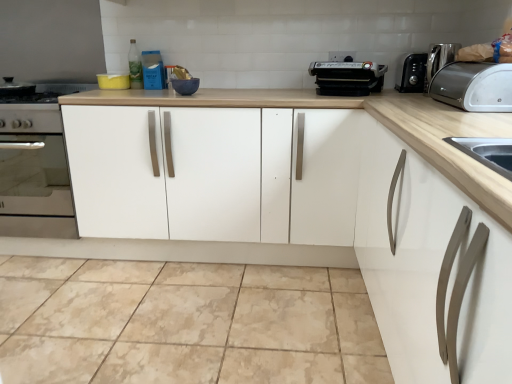
Question: Is satin silver coffee machine at upper right bigger than satin silver toaster at upper right?

Choices:
 (A) yes
 (B) no

Answer: (B)

Question: From the image's perspective, is satin silver coffee machine at upper right beneath satin silver toaster at upper right?

Choices:
 (A) no
 (B) yes

Answer: (A)

Question: Is satin silver coffee machine at upper right not inside satin silver toaster at upper right?

Choices:
 (A) yes
 (B) no

Answer: (A)

Question: From a real-world perspective, is satin silver coffee machine at upper right located higher than satin silver toaster at upper right?

Choices:
 (A) yes
 (B) no

Answer: (A)

Question: Would you say satin silver coffee machine at upper right contains satin silver toaster at upper right?

Choices:
 (A) yes
 (B) no

Answer: (B)

Question: Is satin silver coffee machine at upper right at the right side of satin silver toaster at upper right?

Choices:
 (A) yes
 (B) no

Answer: (B)

Question: Is white matte cabinet at center not near green glass bottle at upper center?

Choices:
 (A) no
 (B) yes

Answer: (A)

Question: From a real-world perspective, does white matte cabinet at center sit lower than green glass bottle at upper center?

Choices:
 (A) yes
 (B) no

Answer: (A)

Question: Is white matte cabinet at center thinner than green glass bottle at upper center?

Choices:
 (A) no
 (B) yes

Answer: (A)

Question: Is white matte cabinet at center at the right side of green glass bottle at upper center?

Choices:
 (A) no
 (B) yes

Answer: (B)

Question: Does white matte cabinet at center come behind green glass bottle at upper center?

Choices:
 (A) yes
 (B) no

Answer: (B)

Question: From the image's perspective, is white matte cabinet at center located beneath green glass bottle at upper center?

Choices:
 (A) no
 (B) yes

Answer: (B)

Question: From the image's perspective, is satin silver toaster at upper right below green glass bottle at upper center?

Choices:
 (A) no
 (B) yes

Answer: (B)